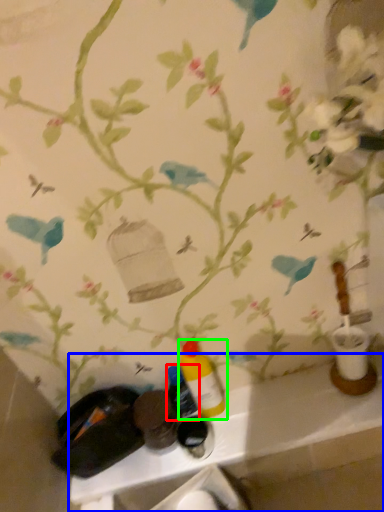
Question: Which object is positioned farthest from bottle (highlighted by a red box)? Select from counter (highlighted by a blue box) and bottle (highlighted by a green box).

Choices:
 (A) counter
 (B) bottle

Answer: (A)